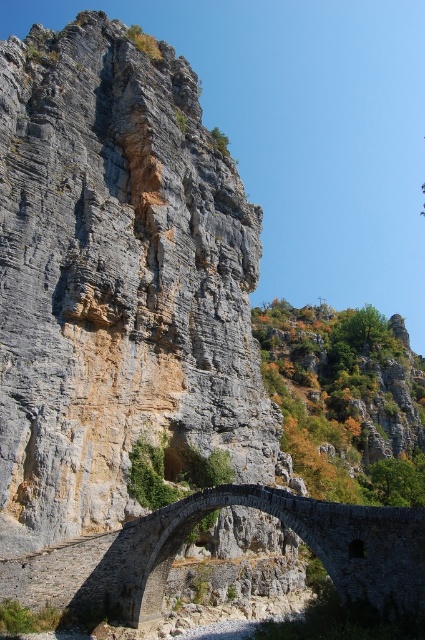
Question: Does dark gray stone bridge at center appear under green leafy hillside at center?

Choices:
 (A) yes
 (B) no

Answer: (A)

Question: Is dark gray stone bridge at center thinner than green leafy hillside at center?

Choices:
 (A) no
 (B) yes

Answer: (B)

Question: Which point is closer to the camera?

Choices:
 (A) (99, 605)
 (B) (342, 369)

Answer: (A)

Question: Which point is closer to the camera taking this photo?

Choices:
 (A) (408, 547)
 (B) (362, 368)

Answer: (A)

Question: Is dark gray stone bridge at center smaller than green leafy hillside at center?

Choices:
 (A) no
 (B) yes

Answer: (B)